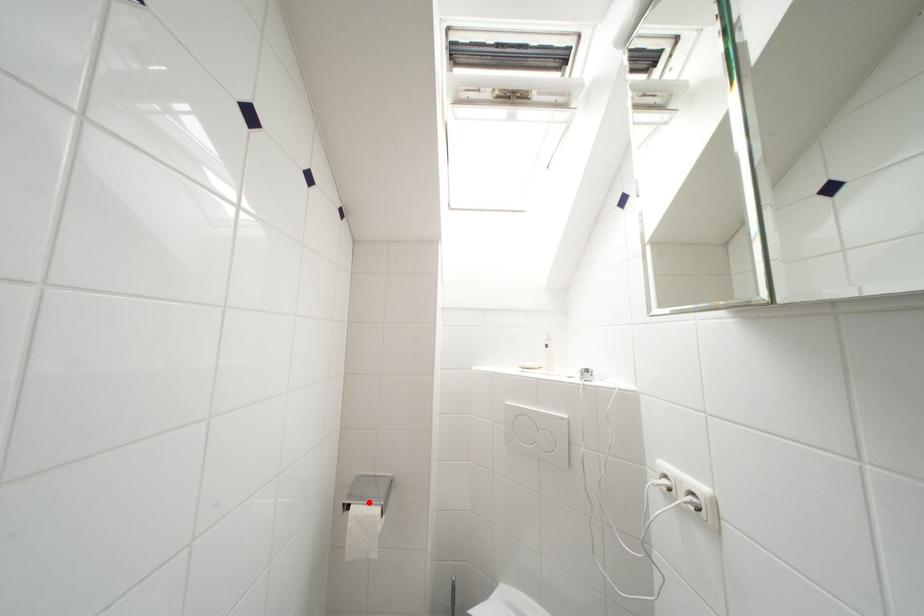
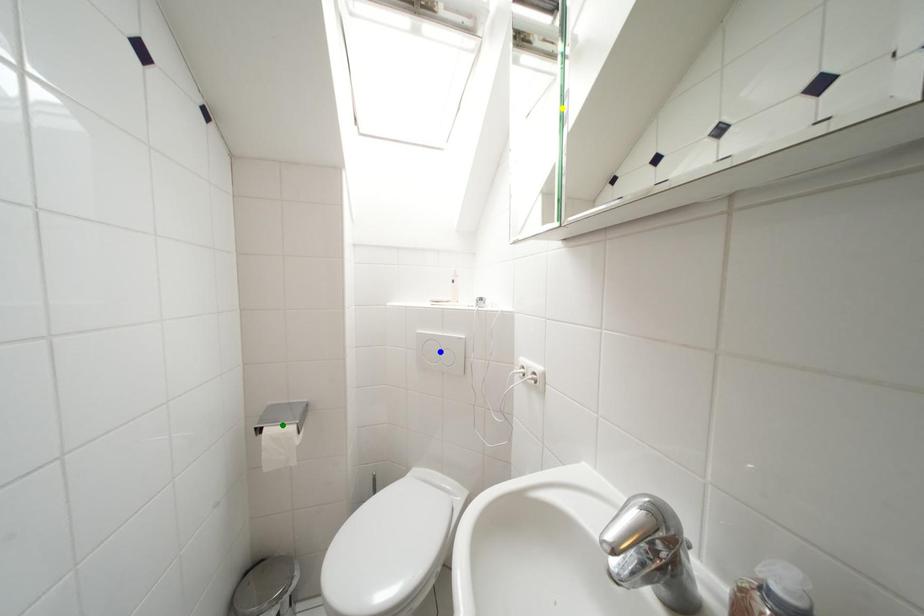
Question: I am providing you with two images of the same scene from different viewpoints. A red point is marked on the first image. You are given multiple points on the second image. Which point in image 2 is actually the same real-world point as the red point in image 1?

Choices:
 (A) yellow point
 (B) green point
 (C) blue point

Answer: (B)